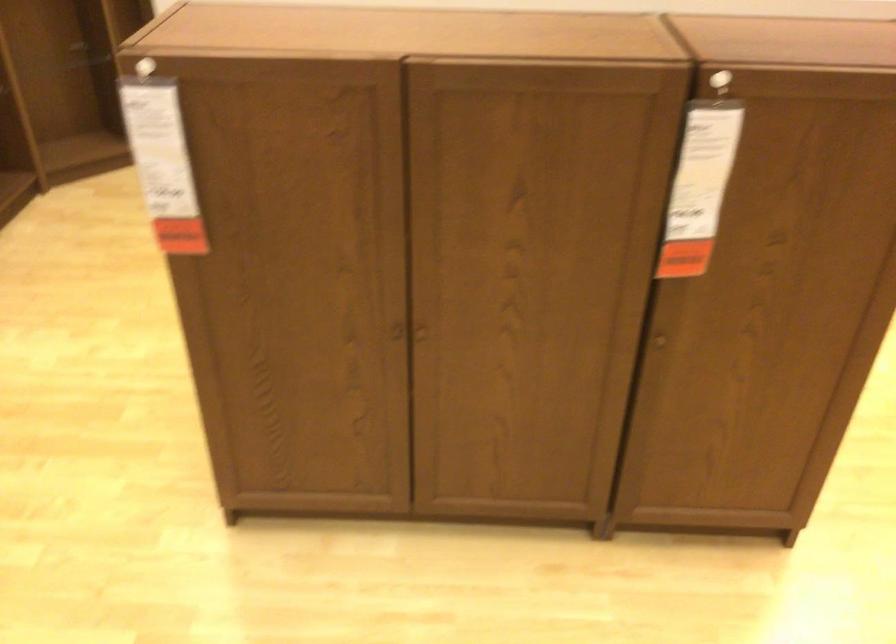
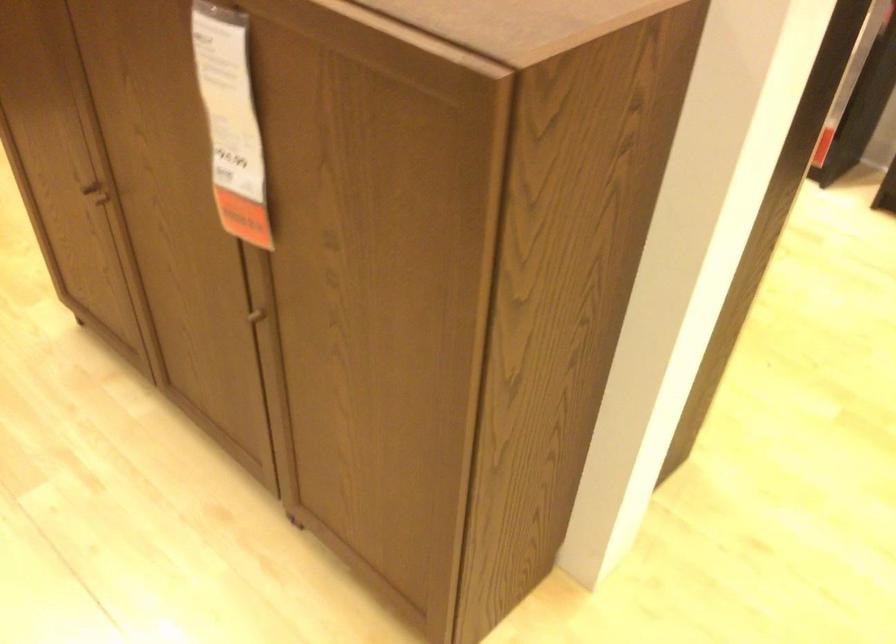
In the second image, find the point that corresponds to point 394,337 in the first image.

(95, 196)